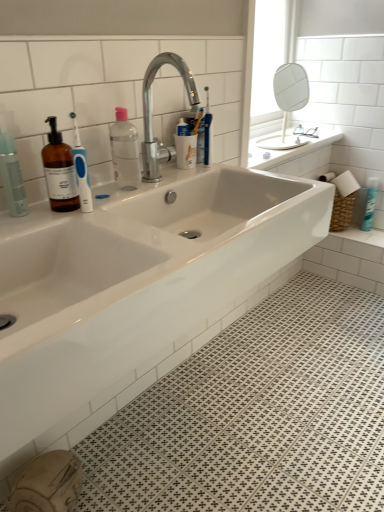
Question: In terms of size, does chrome metallic faucet at upper center appear bigger or smaller than white glossy spray can at upper right, the second toiletry in the left-to-right sequence?

Choices:
 (A) small
 (B) big

Answer: (B)

Question: From a real-world perspective, is chrome metallic faucet at upper center physically located above or below white glossy spray can at upper right, the second toiletry in the left-to-right sequence?

Choices:
 (A) below
 (B) above

Answer: (B)

Question: Estimate the real-world distances between objects in this image. Which object is farther from the white glossy sink at center?

Choices:
 (A) chrome metallic faucet at upper center
 (B) matte black spray can at left, which is counted as the 1th toiletry, starting from the front
 (C) transparent plastic bottle at center
 (D) white glossy spray can at upper right, marked as the first toiletry in a back-to-front arrangement
 (E) white glossy mirror at upper right

Answer: (E)

Question: Which is farther from the white glossy mirror at upper right?

Choices:
 (A) white glossy sink at upper right
 (B) transparent plastic bottle at center
 (C) white glossy sink at center
 (D) chrome metallic faucet at upper center
 (E) white glossy spray can at upper right, the second toiletry in the left-to-right sequence

Answer: (C)